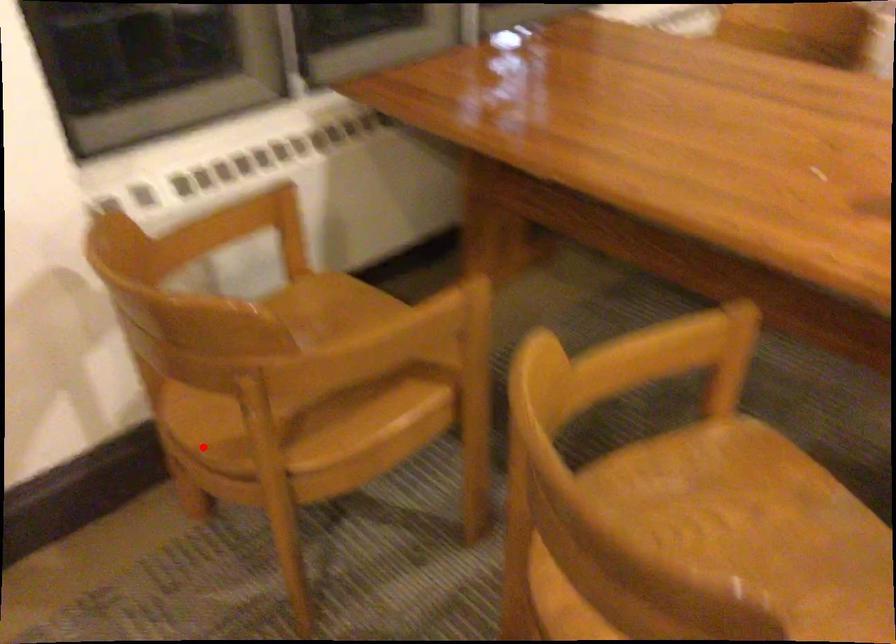
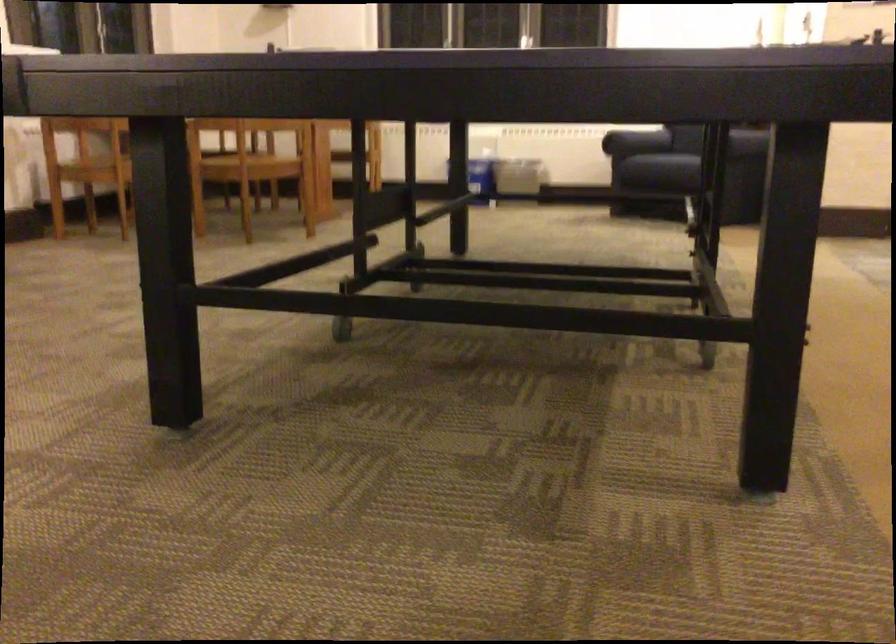
Where in the second image is the point corresponding to the highlighted location from the first image?

(95, 169)